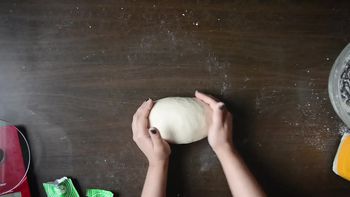
What are the coordinates of `bowl` in the screenshot? It's located at (341, 99).